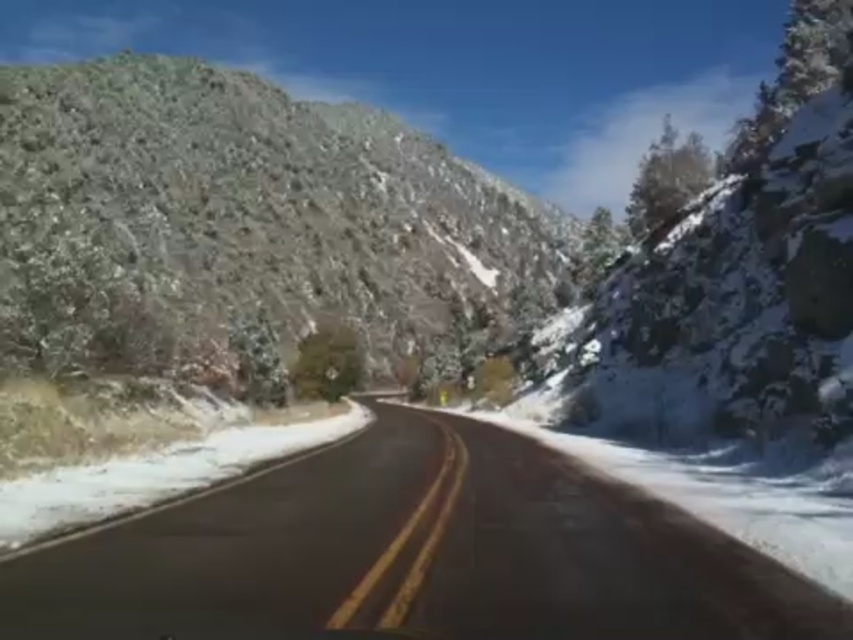
You are a hiker standing at the center of the road in the image. You need to place a marker exactly at the location of the green rock at upper left. According to the coordinates provided, where should you place the marker?

The marker should be placed at coordinates point (242, 221) where the green rock at upper left is located.